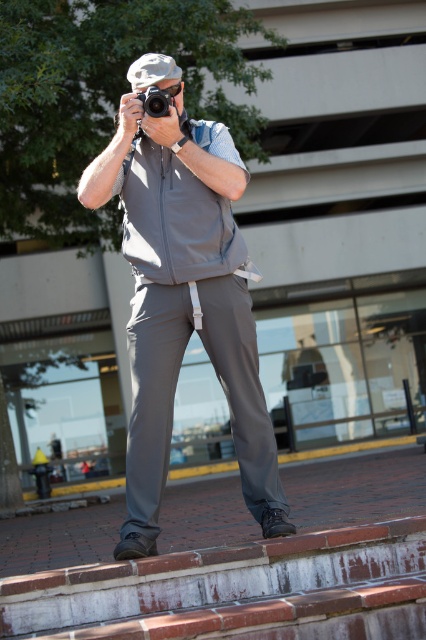
You are a photographer standing at the point labeled as point (x=147, y=100) and want to take a picture of the building in the background. There is another photographer at point (x=241, y=355). Will the other photographer block your view of the building?

A: Point (x=241, y=355) is in front of point (x=147, y=100), so the photographer at point (x=241, y=355) will block your view of the building.

You are a photographer trying to take a clear picture of the building in the background. However, you notice that your gray matte vest at center might be blocking the view. Can you move your vest to the side so that the matte black camera at center has an unobstructed view of the building?

The gray matte vest at center is currently in front of the matte black camera at center, so moving the vest to the side would allow the camera to have an unobstructed view of the building.